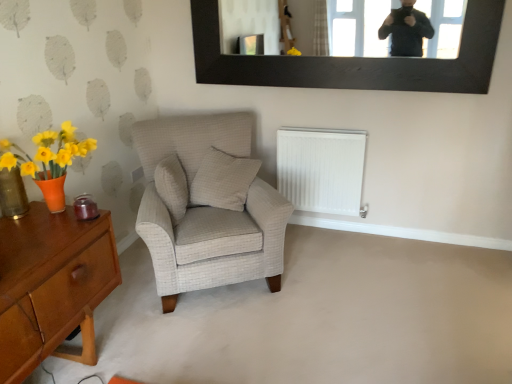
What do you see at coordinates (172, 186) in the screenshot? I see `beige textured pillow at center, positioned as the 1th pillow in left-to-right order` at bounding box center [172, 186].

The width and height of the screenshot is (512, 384). I want to click on translucent amber glass vase at left, so click(13, 194).

Identify the location of wooden desk at lower left. [52, 286].

Locate an element on the screen. The width and height of the screenshot is (512, 384). white plastic radiator at lower center is located at coordinates (321, 169).

In the scene shown: Is beige textured pillow at center, which is the 2th pillow in right-to-left order, touching white checkered pillow at center, which is the 1th pillow from right to left?

No, beige textured pillow at center, which is the 2th pillow in right-to-left order, is not in contact with white checkered pillow at center, which is the 1th pillow from right to left.

This screenshot has height=384, width=512. Identify the location of pillow lying on the right of beige textured pillow at center, which is the 2th pillow in right-to-left order. (223, 180).

Which object is further away from the camera, beige textured pillow at center, positioned as the 1th pillow in left-to-right order, or white checkered pillow at center, the 2th pillow viewed from the left?

white checkered pillow at center, the 2th pillow viewed from the left, is further from the camera.

Between translucent amber glass vase at left and white plastic radiator at lower center, which one has more height?

Standing taller between the two is white plastic radiator at lower center.

Is translucent amber glass vase at left next to white plastic radiator at lower center?

translucent amber glass vase at left and white plastic radiator at lower center are clearly separated.

Find the location of `glass vase above the white plastic radiator at lower center (from a real-world perspective)`. glass vase above the white plastic radiator at lower center (from a real-world perspective) is located at coordinates click(13, 194).

Can you confirm if translucent amber glass vase at left is wider than white plastic radiator at lower center?

No.

Do you think white plastic radiator at lower center is within beige textured pillow at center, positioned as the 1th pillow in left-to-right order, or outside of it?

white plastic radiator at lower center cannot be found inside beige textured pillow at center, positioned as the 1th pillow in left-to-right order.

Considering the relative sizes of white plastic radiator at lower center and beige textured pillow at center, positioned as the 1th pillow in left-to-right order, in the image provided, is white plastic radiator at lower center smaller than beige textured pillow at center, positioned as the 1th pillow in left-to-right order,?

Actually, white plastic radiator at lower center might be larger than beige textured pillow at center, positioned as the 1th pillow in left-to-right order.

From the picture: From their relative heights in the image, would you say white plastic radiator at lower center is taller or shorter than beige textured pillow at center, positioned as the 1th pillow in left-to-right order?

Considering their sizes, white plastic radiator at lower center has more height than beige textured pillow at center, positioned as the 1th pillow in left-to-right order.

Is white plastic radiator at lower center facing towards beige textured pillow at center, positioned as the 1th pillow in left-to-right order?

No, white plastic radiator at lower center is not oriented towards beige textured pillow at center, positioned as the 1th pillow in left-to-right order.

Consider the image. Is black wood picture frame at upper center shorter than white checkered pillow at center, the 2th pillow viewed from the left?

Incorrect, the height of black wood picture frame at upper center does not fall short of that of white checkered pillow at center, the 2th pillow viewed from the left.

Which point is more forward, (351,70) or (252,166)?

Positioned in front is point (252,166).

Considering the positions of objects black wood picture frame at upper center and white checkered pillow at center, the 2th pillow viewed from the left, in the image provided, who is in front, black wood picture frame at upper center or white checkered pillow at center, the 2th pillow viewed from the left,?

black wood picture frame at upper center.

Are black wood picture frame at upper center and white checkered pillow at center, the 2th pillow viewed from the left, beside each other?

No, black wood picture frame at upper center is not making contact with white checkered pillow at center, the 2th pillow viewed from the left.

Which is correct: black wood picture frame at upper center is inside beige textured pillow at center, which is the 2th pillow in right-to-left order, or outside of it?

black wood picture frame at upper center lies outside beige textured pillow at center, which is the 2th pillow in right-to-left order.

Is black wood picture frame at upper center smaller than beige textured pillow at center, positioned as the 1th pillow in left-to-right order?

Incorrect, black wood picture frame at upper center is not smaller in size than beige textured pillow at center, positioned as the 1th pillow in left-to-right order.

Which of these two, black wood picture frame at upper center or beige textured pillow at center, positioned as the 1th pillow in left-to-right order, stands shorter?

beige textured pillow at center, positioned as the 1th pillow in left-to-right order, is shorter.

You are a GUI agent. You are given a task and a screenshot of the screen. Output one action in this format:
    pyautogui.click(x=<x>, y=<y>)
    Task: Click on the picture frame behind the beige textured pillow at center, which is the 2th pillow in right-to-left order
    The image size is (512, 384).
    Given the screenshot: What is the action you would take?
    pyautogui.click(x=354, y=60)

The width and height of the screenshot is (512, 384). Find the location of `radiator located on the right of wooden desk at lower left`. radiator located on the right of wooden desk at lower left is located at coordinates (321, 169).

From a real-world perspective, which is physically below, white plastic radiator at lower center or wooden desk at lower left?

wooden desk at lower left, from a real-world perspective.

From the image's perspective, is white plastic radiator at lower center under wooden desk at lower left?

No, from the image's perspective, white plastic radiator at lower center is not beneath wooden desk at lower left.

Considering the positions of objects white plastic radiator at lower center and wooden desk at lower left in the image provided, who is behind, white plastic radiator at lower center or wooden desk at lower left?

white plastic radiator at lower center is further from the camera.

Which point is more distant from viewer, (267,184) or (6,215)?

The point (267,184) is more distant.

Considering the relative positions of light gray fabric armchair at center and translucent amber glass vase at left in the image provided, is light gray fabric armchair at center to the right of translucent amber glass vase at left from the viewer's perspective?

Correct, you'll find light gray fabric armchair at center to the right of translucent amber glass vase at left.

Is light gray fabric armchair at center bigger or smaller than translucent amber glass vase at left?

In the image, light gray fabric armchair at center appears to be larger than translucent amber glass vase at left.

Where is `pillow that is in front of the white checkered pillow at center, the 2th pillow viewed from the left`? The width and height of the screenshot is (512, 384). pillow that is in front of the white checkered pillow at center, the 2th pillow viewed from the left is located at coordinates (172, 186).

Find the location of a particular element. The height and width of the screenshot is (384, 512). radiator located on the right of translucent amber glass vase at left is located at coordinates 321,169.

Based on their spatial positions, is translucent amber glass vase at left or black wood picture frame at upper center further from white plastic radiator at lower center?

translucent amber glass vase at left.

Which object lies nearer to the anchor point white checkered pillow at center, which is the 1th pillow from right to left, wooden desk at lower left or light gray fabric armchair at center?

light gray fabric armchair at center lies closer to white checkered pillow at center, which is the 1th pillow from right to left, than the other object.

Which object lies nearer to the anchor point light gray fabric armchair at center, wooden desk at lower left or beige textured pillow at center, positioned as the 1th pillow in left-to-right order?

beige textured pillow at center, positioned as the 1th pillow in left-to-right order.

Considering their positions, is light gray fabric armchair at center positioned closer to translucent amber glass vase at left than black wood picture frame at upper center?

light gray fabric armchair at center is closer to translucent amber glass vase at left.

Based on their spatial positions, is black wood picture frame at upper center or white checkered pillow at center, which is the 1th pillow from right to left, closer to translucent amber glass vase at left?

white checkered pillow at center, which is the 1th pillow from right to left, is closer to translucent amber glass vase at left.

Based on their spatial positions, is wooden desk at lower left or translucent amber glass vase at left closer to white checkered pillow at center, which is the 1th pillow from right to left?

The object closer to white checkered pillow at center, which is the 1th pillow from right to left, is wooden desk at lower left.

Looking at the image, which one is located further to white checkered pillow at center, the 2th pillow viewed from the left, beige textured pillow at center, positioned as the 1th pillow in left-to-right order, or light gray fabric armchair at center?

Based on the image, beige textured pillow at center, positioned as the 1th pillow in left-to-right order, appears to be further to white checkered pillow at center, the 2th pillow viewed from the left.

Looking at the image, which one is located closer to light gray fabric armchair at center, black wood picture frame at upper center or wooden desk at lower left?

wooden desk at lower left lies closer to light gray fabric armchair at center than the other object.

The height and width of the screenshot is (384, 512). Identify the location of radiator located between translucent amber glass vase at left and black wood picture frame at upper center in the left-right direction. (321, 169).

What are the coordinates of `chair between beige textured pillow at center, which is the 2th pillow in right-to-left order, and white plastic radiator at lower center, in the horizontal direction` in the screenshot? It's located at (207, 211).

The height and width of the screenshot is (384, 512). In order to click on chair between wooden desk at lower left and beige textured pillow at center, which is the 2th pillow in right-to-left order, along the z-axis in this screenshot , I will do `click(207, 211)`.

You are a GUI agent. You are given a task and a screenshot of the screen. Output one action in this format:
    pyautogui.click(x=<x>, y=<y>)
    Task: Click on the pillow situated between light gray fabric armchair at center and white plastic radiator at lower center from left to right
    Image resolution: width=512 pixels, height=384 pixels.
    Given the screenshot: What is the action you would take?
    pyautogui.click(x=223, y=180)